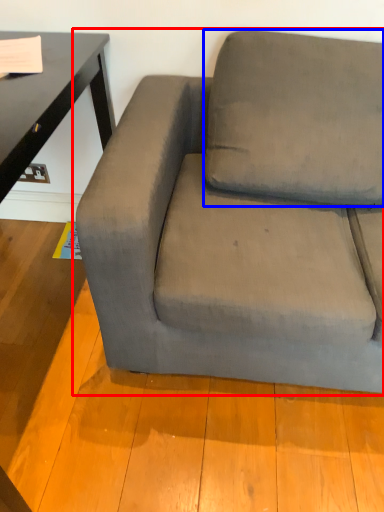
Question: Among these objects, which one is nearest to the camera, studio couch (highlighted by a red box) or pillow (highlighted by a blue box)?

Choices:
 (A) studio couch
 (B) pillow

Answer: (A)